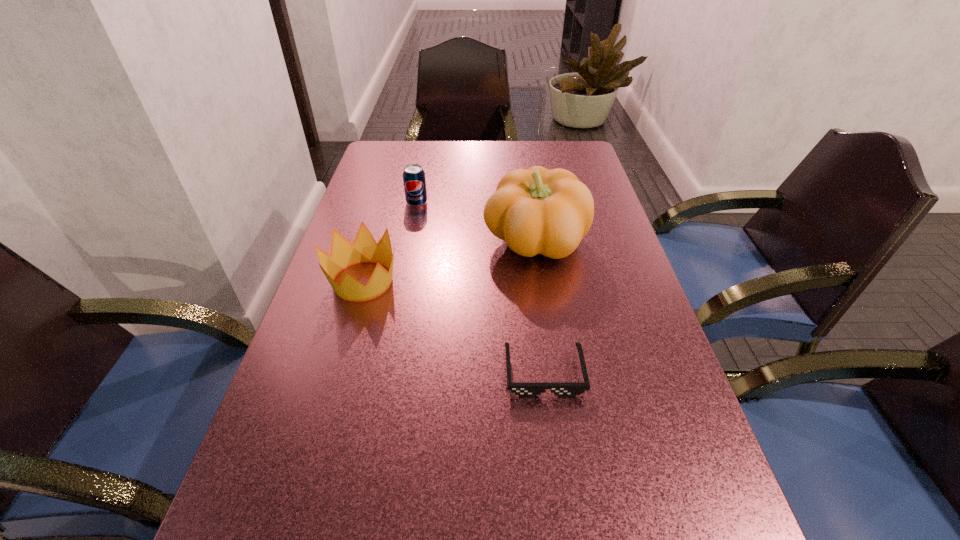
Find the location of a particular element. vacant region between the soda can and the nearest object is located at coordinates (480, 288).

Locate an element on the screen. The image size is (960, 540). empty location between the shortest object and the pumpkin is located at coordinates (540, 307).

At what (x,y) coordinates should I click in order to perform the action: click on free space between the tallest object and the shortest object. Please return your answer as a coordinate pair (x, y). The width and height of the screenshot is (960, 540). Looking at the image, I should click on (540, 307).

The image size is (960, 540). Identify the location of empty space between the crown and the shortest object. [x=453, y=327].

Where is `vacant area that lies between the sunglasses and the farthest object`? The width and height of the screenshot is (960, 540). vacant area that lies between the sunglasses and the farthest object is located at coordinates (480, 288).

The height and width of the screenshot is (540, 960). Identify the location of free space that is in between the crown and the pumpkin. (449, 261).

Find the location of a particular element. the closest object to the crown is located at coordinates (536, 211).

At what (x,y) coordinates should I click in order to perform the action: click on object identified as the third closest to the soda can. Please return your answer as a coordinate pair (x, y). This screenshot has height=540, width=960. Looking at the image, I should click on (521, 389).

Where is `vacant position in the image that satisfies the following two spatial constraints: 1. on the back side of the crown; 2. on the right side of the tallest object`? The height and width of the screenshot is (540, 960). vacant position in the image that satisfies the following two spatial constraints: 1. on the back side of the crown; 2. on the right side of the tallest object is located at coordinates (374, 241).